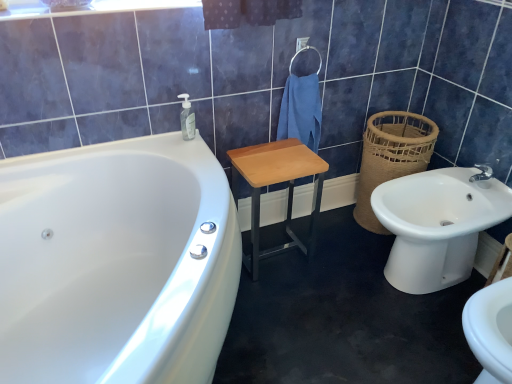
Identify the location of vacant space that's between white ceramic sink at right and wooden/matte step stool at center. (333, 265).